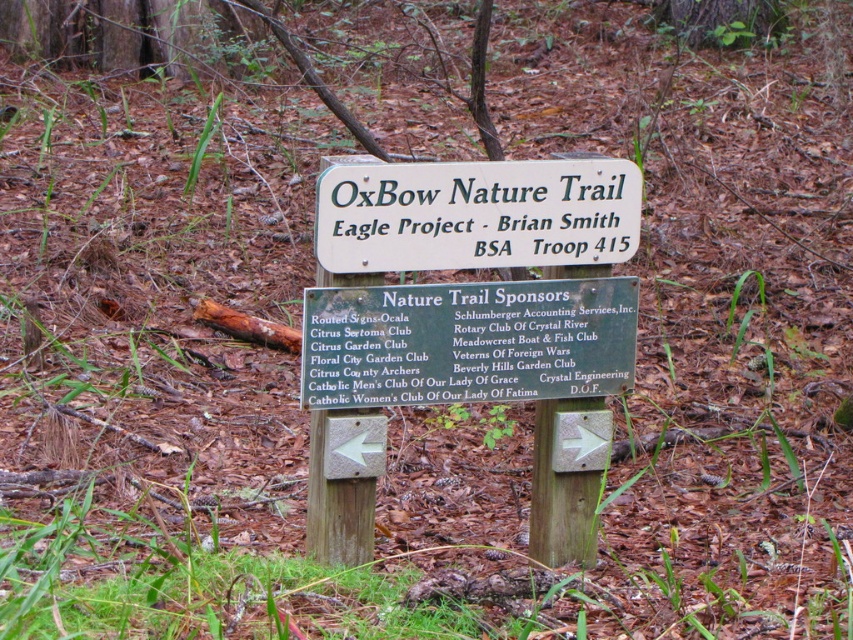
Question: Is green wood sign at center above white wood sign at center?

Choices:
 (A) no
 (B) yes

Answer: (A)

Question: Can you confirm if green wood sign at center is thinner than white wood sign at center?

Choices:
 (A) no
 (B) yes

Answer: (A)

Question: Which point is closer to the camera?

Choices:
 (A) (451, 365)
 (B) (579, 193)

Answer: (A)

Question: Can you confirm if green wood sign at center is positioned to the left of white wood sign at center?

Choices:
 (A) yes
 (B) no

Answer: (A)